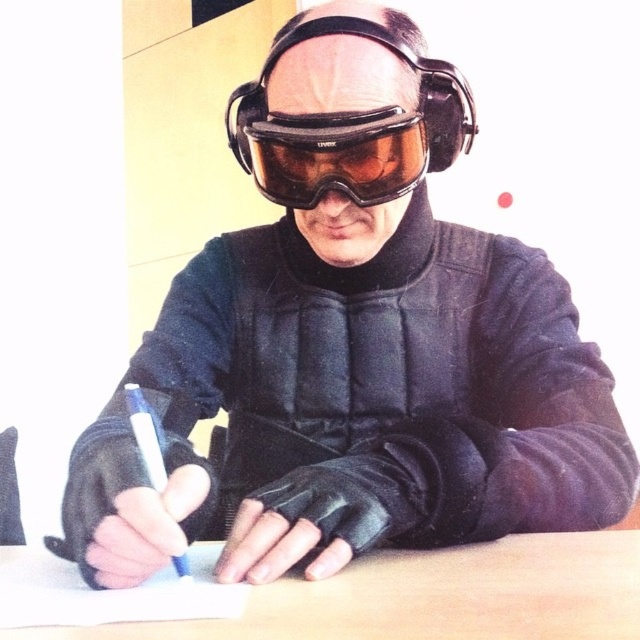
Between point (259, 628) and point (237, 144), which one is positioned in front?

Point (259, 628)

Does wooden table at center have a larger size compared to brown matte/glossy goggles at center?

Actually, wooden table at center might be smaller than brown matte/glossy goggles at center.

Measure the distance between point (428, 612) and camera.

The distance of point (428, 612) from camera is 41.43 centimeters.

The width and height of the screenshot is (640, 640). I want to click on wooden table at center, so click(435, 596).

Who is higher up, matte black helmet at center or blue plastic pen at center?

matte black helmet at center is above.

Does point (241, 100) lie in front of point (132, 416)?

No, it is not.

Is point (467, 113) positioned before point (134, 390)?

No, it is not.

At what (x,y) coordinates should I click in order to perform the action: click on matte black helmet at center. Please return your answer as a coordinate pair (x, y). This screenshot has width=640, height=640. Looking at the image, I should click on (349, 129).

Measure the distance between point (x=396, y=173) and camera.

26.85 inches

Who is taller, brown matte/glossy goggles at center or blue plastic pen at center?

Standing taller between the two is blue plastic pen at center.

Does point (326, 118) come farther from viewer compared to point (163, 486)?

Yes, point (326, 118) is behind point (163, 486).

The image size is (640, 640). Identify the location of brown matte/glossy goggles at center. (333, 156).